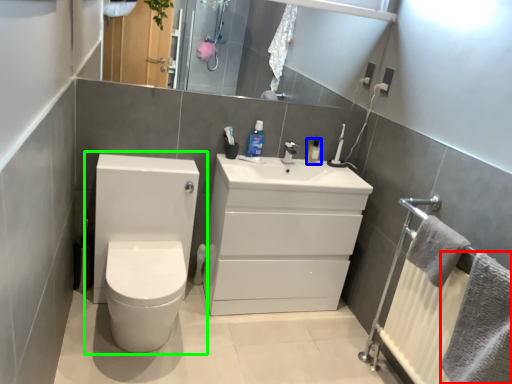
Question: Based on their relative distances, which object is nearer to bath towel (highlighted by a red box)? Choose from mouthwash (highlighted by a blue box) and toilet (highlighted by a green box).

Choices:
 (A) mouthwash
 (B) toilet

Answer: (A)